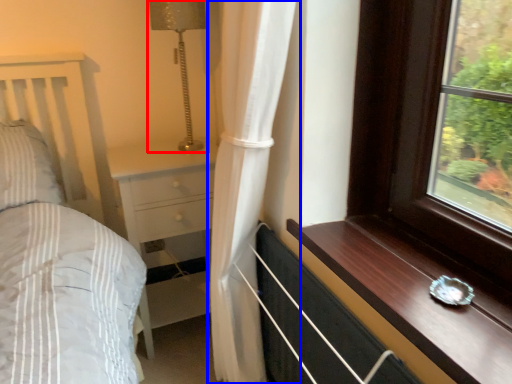
Question: Among these objects, which one is farthest to the camera, lamp (highlighted by a red box) or curtain (highlighted by a blue box)?

Choices:
 (A) lamp
 (B) curtain

Answer: (A)